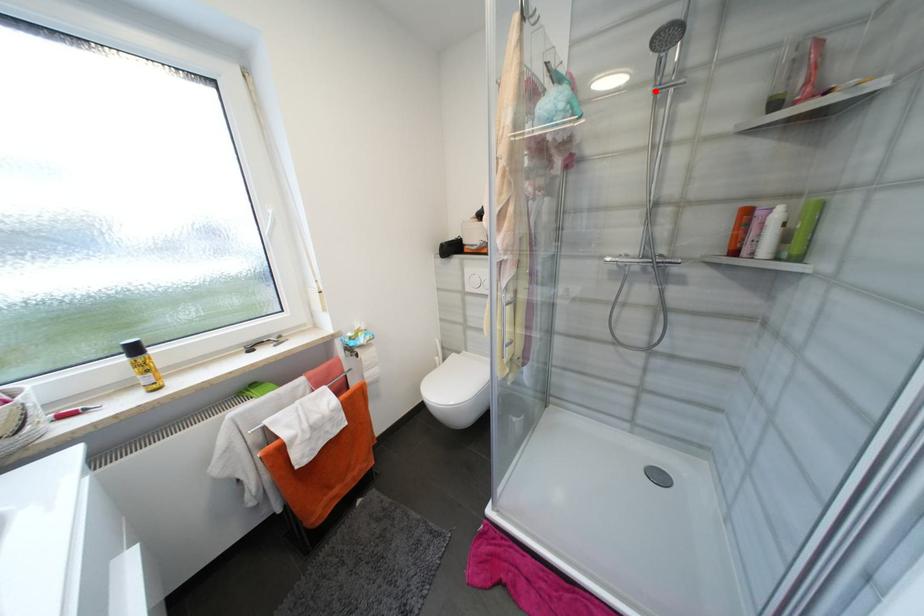
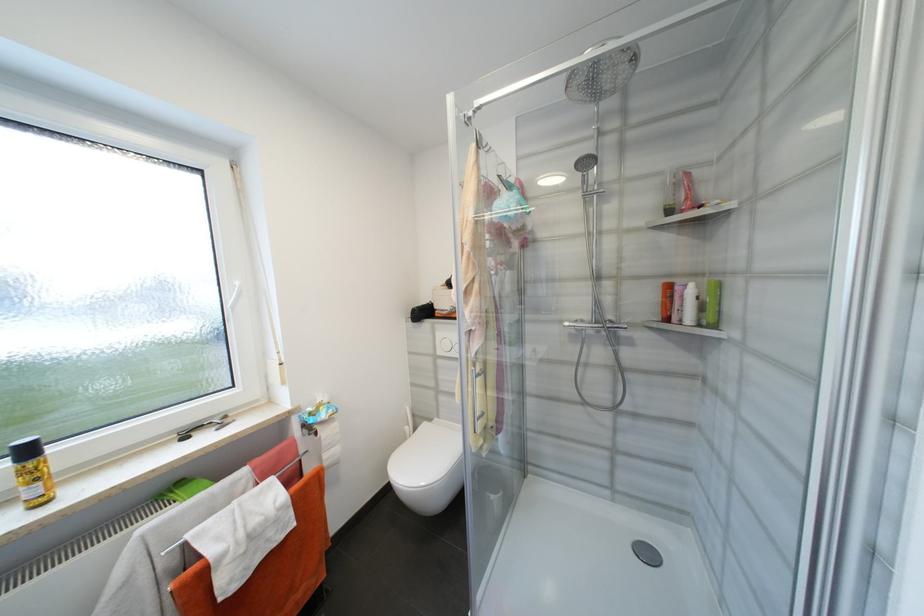
Question: I am providing you with two images of the same scene from different viewpoints. A red point is marked on the first image. Is the red point's position out of view in image 2?

Choices:
 (A) Yes
 (B) No

Answer: (B)